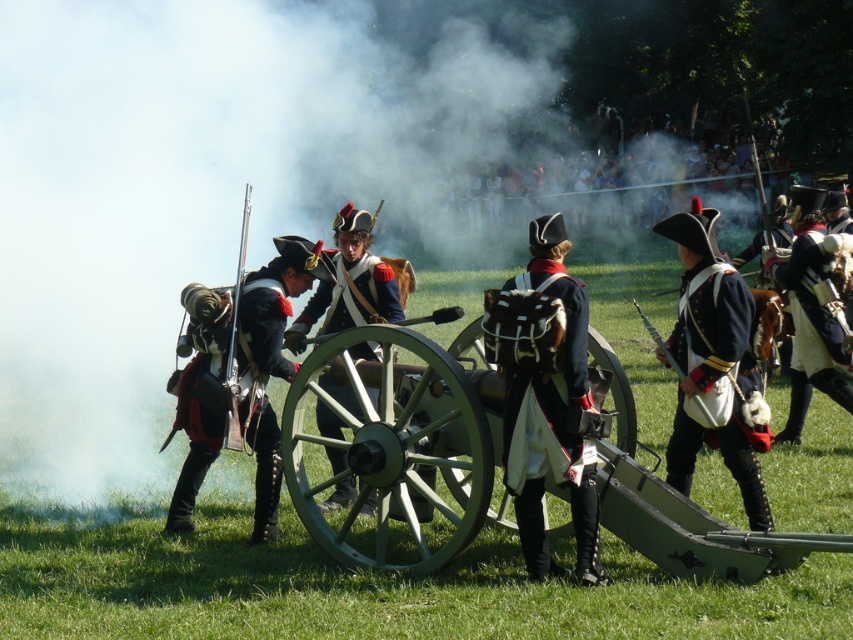
Which is below, green polished wood cannon at center or white cotton uniform at right?

green polished wood cannon at center is below.

Which is more to the right, green polished wood cannon at center or white cotton uniform at right?

From the viewer's perspective, white cotton uniform at right appears more on the right side.

Where is `green polished wood cannon at center`? The width and height of the screenshot is (853, 640). green polished wood cannon at center is located at coordinates (399, 449).

Is blue woolen coat at center closer to camera compared to white cotton uniform at right?

Yes, blue woolen coat at center is closer to the viewer.

Describe the element at coordinates (352, 298) in the screenshot. I see `blue woolen coat at center` at that location.

Where is `blue woolen coat at center`? The image size is (853, 640). blue woolen coat at center is located at coordinates (352, 298).

Can you confirm if green polished wood cannon at center is bigger than matte black uniform at left?

Correct, green polished wood cannon at center is larger in size than matte black uniform at left.

Which is behind, point (326, 360) or point (263, 406)?

The point (263, 406) is behind.

Is point (675, 545) positioned before point (242, 314)?

That is True.

Locate an element on the screen. green polished wood cannon at center is located at coordinates (399, 449).